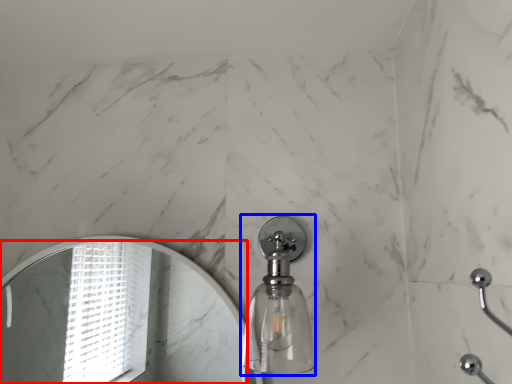
Question: Which point is closer to the camera, mirror (highlighted by a red box) or soap dispenser (highlighted by a blue box)?

Choices:
 (A) mirror
 (B) soap dispenser

Answer: (B)